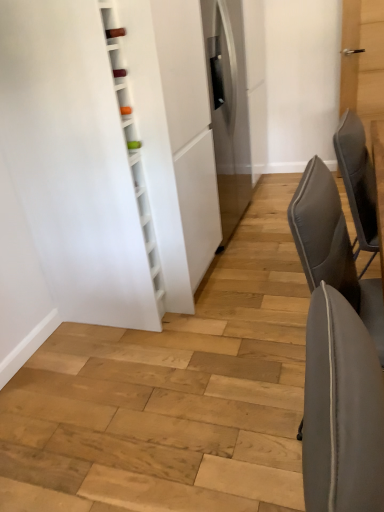
Question: Considering their positions, is gray fabric chair at right, acting as the 1th chair starting from the bottom, located in front of or behind gray fabric chair at right, the first chair when ordered from top to bottom?

Choices:
 (A) behind
 (B) front

Answer: (B)

Question: Is gray fabric chair at right, acting as the 1th chair starting from the bottom, spatially inside gray fabric chair at right, acting as the 2th chair starting from the bottom, or outside of it?

Choices:
 (A) outside
 (B) inside

Answer: (A)

Question: Considering the positions of gray fabric chair at right, acting as the 1th chair starting from the bottom, and gray fabric chair at right, the first chair when ordered from top to bottom, in the image, is gray fabric chair at right, acting as the 1th chair starting from the bottom, taller or shorter than gray fabric chair at right, the first chair when ordered from top to bottom,?

Choices:
 (A) tall
 (B) short

Answer: (A)

Question: Considering the positions of point (372, 228) and point (370, 305), is point (372, 228) closer or farther from the camera than point (370, 305)?

Choices:
 (A) farther
 (B) closer

Answer: (A)

Question: Considering their positions, is gray fabric chair at right, the first chair when ordered from top to bottom, located in front of or behind gray fabric chair at right, which is the second chair in top-to-bottom order?

Choices:
 (A) behind
 (B) front

Answer: (A)

Question: Is gray fabric chair at right, acting as the 2th chair starting from the bottom, taller or shorter than gray fabric chair at right, acting as the 1th chair starting from the bottom?

Choices:
 (A) short
 (B) tall

Answer: (A)

Question: Based on their sizes in the image, would you say gray fabric chair at right, the first chair when ordered from top to bottom, is bigger or smaller than gray fabric chair at right, which is the second chair in top-to-bottom order?

Choices:
 (A) big
 (B) small

Answer: (B)